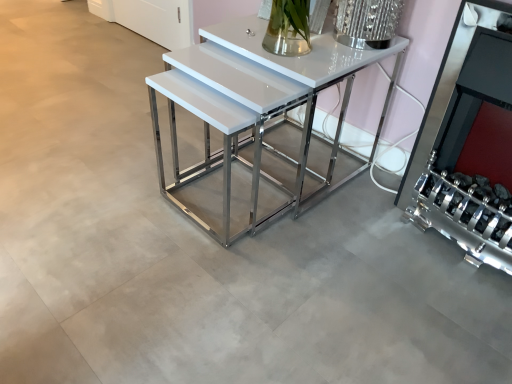
The height and width of the screenshot is (384, 512). What are the coordinates of `free area below silver metallic fireplace at right (from a real-world perspective)` in the screenshot? It's located at (438, 231).